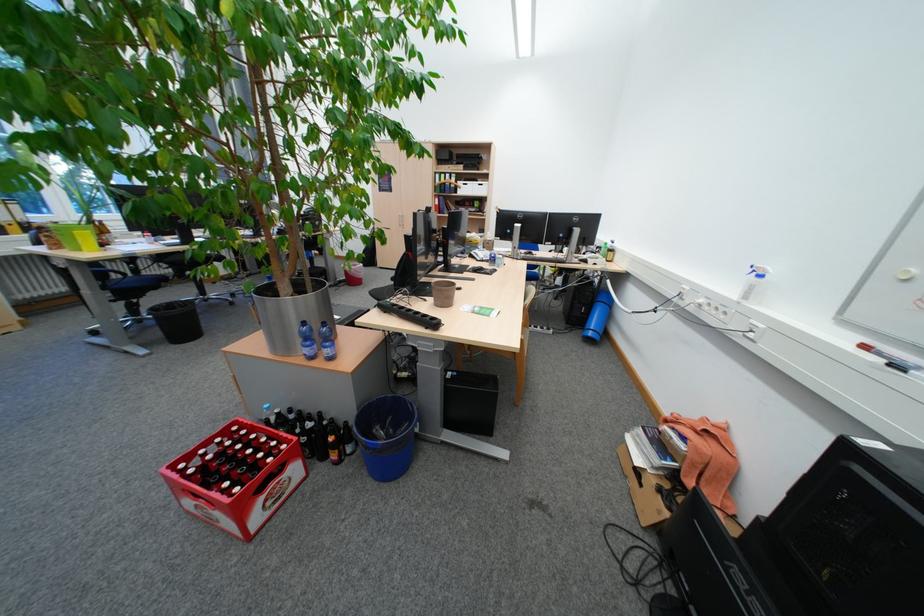
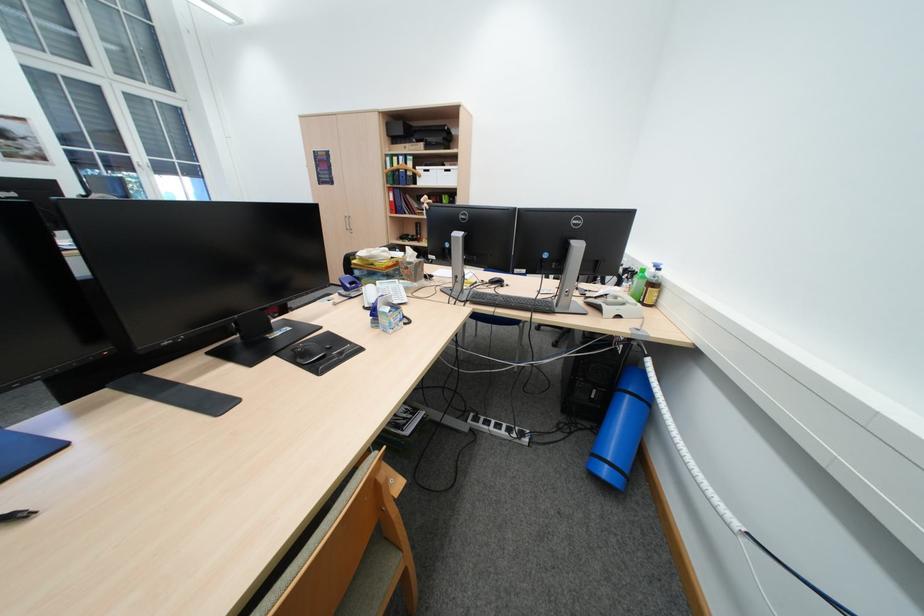
Find the pixel in the second image that matches point 610,248 in the first image.

(638, 272)